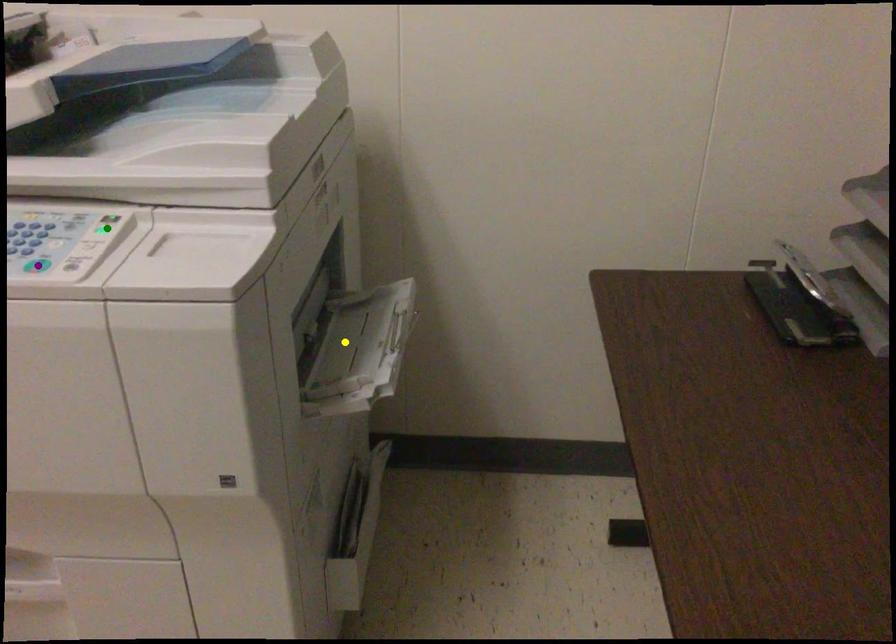
Order these from nearest to farthest:
- green point
- purple point
- yellow point

purple point, green point, yellow point